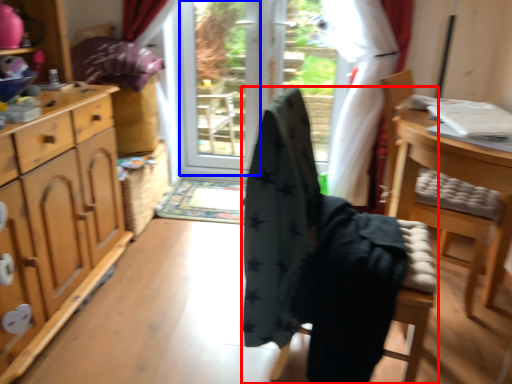
Question: Which object appears farthest to the camera in this image, chair (highlighted by a red box) or screen door (highlighted by a blue box)?

Choices:
 (A) chair
 (B) screen door

Answer: (B)